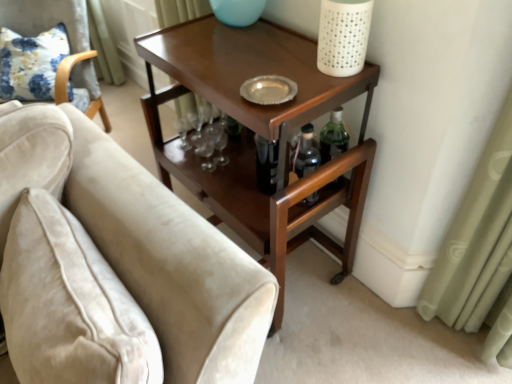
Find the location of a particular element. free point above shiny brown wood side table at center (from a real-world perspective) is located at coordinates (236, 58).